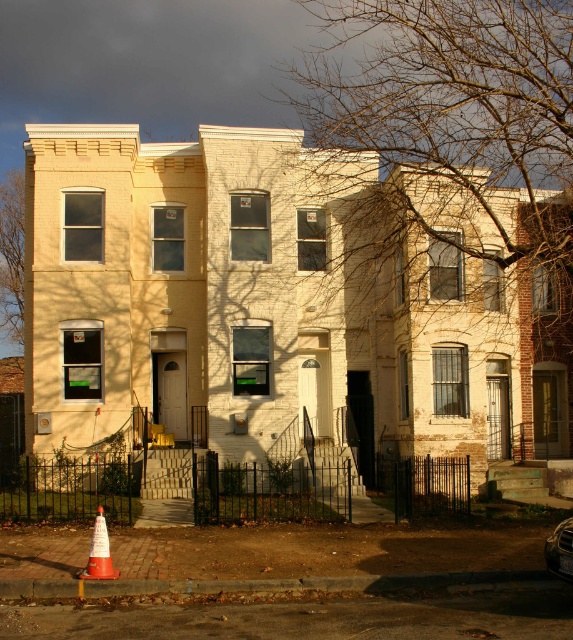
From the picture: You are a delivery driver who needs to park your shiny silver car at center as close as possible to the orange matte traffic cone at lower left. However, there is a black metal fence around the building. Can you park your car next to the traffic cone without hitting the fence?

The orange matte traffic cone at lower left is much taller than the shiny silver car at center, so the car can be parked next to the traffic cone without hitting the fence.

You are a delivery person arriving at the residential building. You need to park your shiny silver car at center near the entrance. Is the orange matte traffic cone at lower left blocking your parking spot?

The orange matte traffic cone at lower left is positioned under the shiny silver car at center, so the traffic cone is already under the car and not blocking the parking spot.